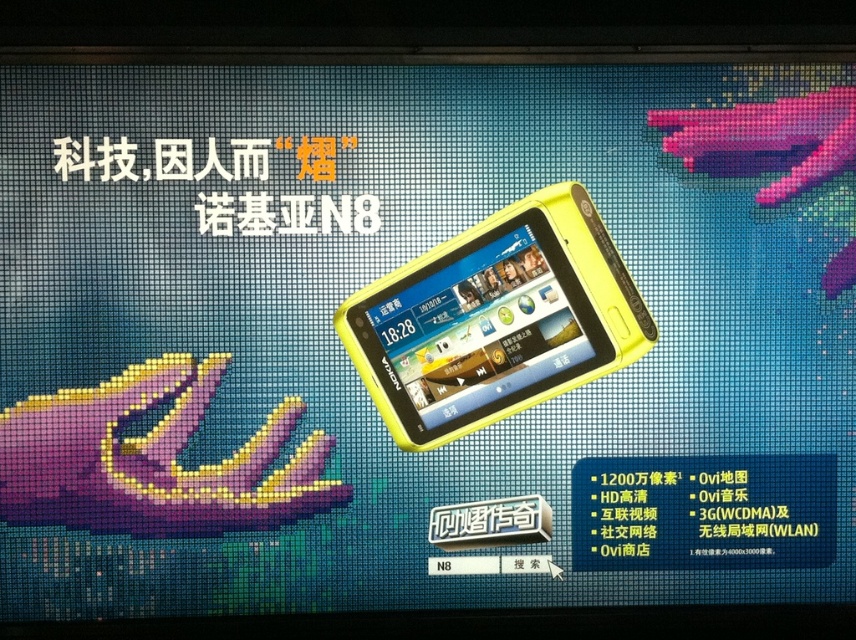
You are designing a layout for a tech advertisement. You have two hands to place in the image, the purple matte hand at lower left and the matte pink plastic hand at upper right. Based on their sizes, which hand should be placed closer to the foreground to maintain visual balance?

The purple matte hand at lower left is larger in size compared to the matte pink plastic hand at upper right. To maintain visual balance, the larger purple matte hand at lower left should be placed closer to the foreground since it has a greater visual weight and needs to be positioned where it can anchor the composition without overwhelming the space.